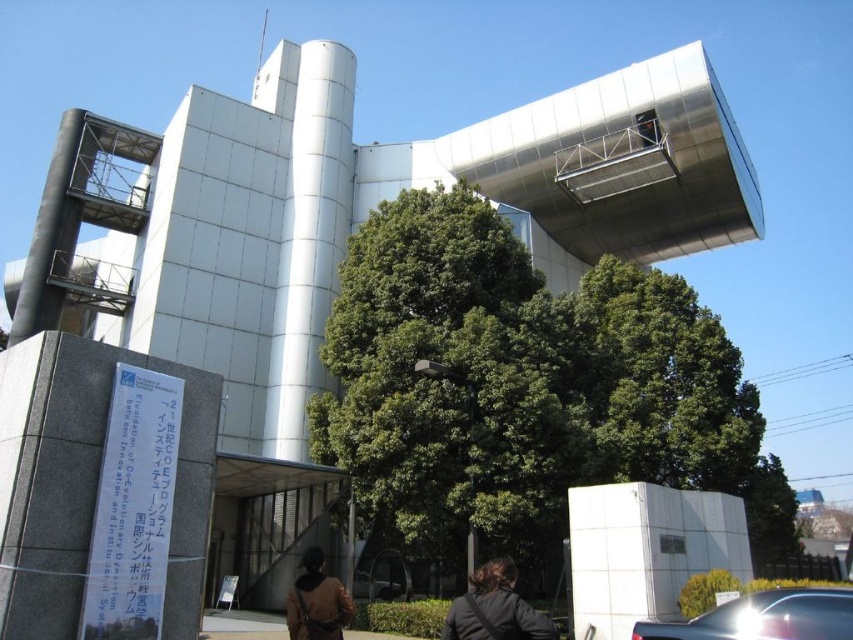
You are standing at the entrance of the building and want to park your car at the shiny metallic car at lower right. What are the coordinates of the parking spot?

The coordinates of the shiny metallic car at lower right are at point [764,618].

You are standing at the base of the building and want to park your car, which is 15 feet long, in the space between the shiny metallic car at lower right and the tree. Can you fit your car there?

The distance between the shiny metallic car at lower right and the viewer is 45.42 feet. Since your car is only 15 feet long, there is sufficient space to park it between the shiny metallic car at lower right and the tree.